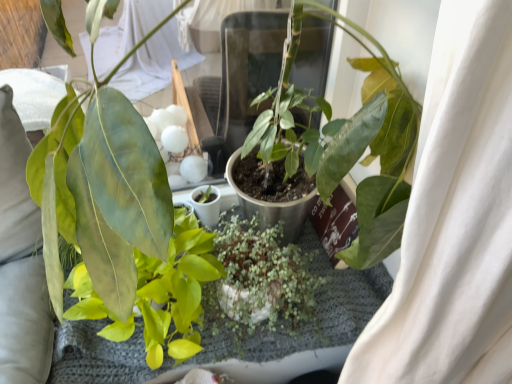
The height and width of the screenshot is (384, 512). I want to click on green matte succulent at center, the second houseplant viewed from the left, so click(265, 274).

Describe the element at coordinates (265, 274) in the screenshot. The image size is (512, 384). I see `green matte succulent at center, the 1th houseplant in the right-to-left sequence` at that location.

What is the approximate width of green glossy leaf at center, which ranks as the 2th houseplant in right-to-left order?

green glossy leaf at center, which ranks as the 2th houseplant in right-to-left order, is 10.77 inches in width.

Locate an element on the screen. green glossy leaf at center, positioned as the first houseplant in left-to-right order is located at coordinates (158, 293).

The width and height of the screenshot is (512, 384). Describe the element at coordinates (158, 293) in the screenshot. I see `green glossy leaf at center, positioned as the first houseplant in left-to-right order` at that location.

What are the coordinates of `green matte succulent at center, the second houseplant viewed from the left` in the screenshot? It's located at (265, 274).

Can you confirm if green matte succulent at center, the second houseplant viewed from the left, is positioned to the left of green glossy leaf at center, positioned as the first houseplant in left-to-right order?

No, green matte succulent at center, the second houseplant viewed from the left, is not to the left of green glossy leaf at center, positioned as the first houseplant in left-to-right order.

Which object is more forward, green matte succulent at center, the 1th houseplant in the right-to-left sequence, or green glossy leaf at center, positioned as the first houseplant in left-to-right order?

green glossy leaf at center, positioned as the first houseplant in left-to-right order.

Considering the positions of points (227, 226) and (185, 350), is point (227, 226) closer to camera compared to point (185, 350)?

No, it is not.

From the image's perspective, which one is positioned lower, green matte succulent at center, the second houseplant viewed from the left, or green glossy leaf at center, which ranks as the 2th houseplant in right-to-left order?

green matte succulent at center, the second houseplant viewed from the left, from the image's perspective.

From a real-world perspective, between green matte succulent at center, the 1th houseplant in the right-to-left sequence, and green glossy leaf at center, which ranks as the 2th houseplant in right-to-left order, who is vertically lower?

green matte succulent at center, the 1th houseplant in the right-to-left sequence, from a real-world perspective.

Can you confirm if green matte succulent at center, the second houseplant viewed from the left, is thinner than green glossy leaf at center, which ranks as the 2th houseplant in right-to-left order?

Yes, green matte succulent at center, the second houseplant viewed from the left, is thinner than green glossy leaf at center, which ranks as the 2th houseplant in right-to-left order.

Based on the photo, can you confirm if green matte succulent at center, the second houseplant viewed from the left, is shorter than green glossy leaf at center, positioned as the first houseplant in left-to-right order?

Yes.

In the scene shown: Between green matte succulent at center, the 1th houseplant in the right-to-left sequence, and green glossy leaf at center, which ranks as the 2th houseplant in right-to-left order, which one has larger size?

With larger size is green glossy leaf at center, which ranks as the 2th houseplant in right-to-left order.

Is green matte succulent at center, the 1th houseplant in the right-to-left sequence, spatially inside green glossy leaf at center, which ranks as the 2th houseplant in right-to-left order, or outside of it?

green matte succulent at center, the 1th houseplant in the right-to-left sequence, exists outside the volume of green glossy leaf at center, which ranks as the 2th houseplant in right-to-left order.

Are green matte succulent at center, the second houseplant viewed from the left, and green glossy leaf at center, which ranks as the 2th houseplant in right-to-left order, located far from each other?

No, green matte succulent at center, the second houseplant viewed from the left, is in close proximity to green glossy leaf at center, which ranks as the 2th houseplant in right-to-left order.

Is green glossy leaf at center, which ranks as the 2th houseplant in right-to-left order, at the back of green matte succulent at center, the second houseplant viewed from the left?

No.

What's the angular difference between green matte succulent at center, the second houseplant viewed from the left, and green glossy leaf at center, which ranks as the 2th houseplant in right-to-left order,'s facing directions?

5.6 degrees.

You are a GUI agent. You are given a task and a screenshot of the screen. Output one action in this format:
    pyautogui.click(x=<x>, y=<y>)
    Task: Click on the houseplant that is in front of the green matte succulent at center, the second houseplant viewed from the left
    This screenshot has height=384, width=512.
    Given the screenshot: What is the action you would take?
    pyautogui.click(x=158, y=293)

In the scene shown: Considering the relative positions of green glossy leaf at center, which ranks as the 2th houseplant in right-to-left order, and green matte succulent at center, the 1th houseplant in the right-to-left sequence, in the image provided, is green glossy leaf at center, which ranks as the 2th houseplant in right-to-left order, to the right of green matte succulent at center, the 1th houseplant in the right-to-left sequence, from the viewer's perspective?

No.

Relative to green matte succulent at center, the 1th houseplant in the right-to-left sequence, is green glossy leaf at center, which ranks as the 2th houseplant in right-to-left order, in front or behind?

Visually, green glossy leaf at center, which ranks as the 2th houseplant in right-to-left order, is located in front of green matte succulent at center, the 1th houseplant in the right-to-left sequence.

Which is closer to the camera, (x=94, y=312) or (x=292, y=326)?

The point (x=94, y=312) is more forward.

Based on the photo, from the image's perspective, between green glossy leaf at center, which ranks as the 2th houseplant in right-to-left order, and green matte succulent at center, the 1th houseplant in the right-to-left sequence, which one is located above?

green glossy leaf at center, which ranks as the 2th houseplant in right-to-left order, from the image's perspective.

Looking at this image, from a real-world perspective, does green glossy leaf at center, which ranks as the 2th houseplant in right-to-left order, sit lower than green matte succulent at center, the 1th houseplant in the right-to-left sequence?

No, from a real-world perspective, green glossy leaf at center, which ranks as the 2th houseplant in right-to-left order, is not beneath green matte succulent at center, the 1th houseplant in the right-to-left sequence.

Is green glossy leaf at center, positioned as the first houseplant in left-to-right order, wider than green matte succulent at center, the 1th houseplant in the right-to-left sequence?

Correct, the width of green glossy leaf at center, positioned as the first houseplant in left-to-right order, exceeds that of green matte succulent at center, the 1th houseplant in the right-to-left sequence.

Considering the relative sizes of green glossy leaf at center, positioned as the first houseplant in left-to-right order, and green matte succulent at center, the 1th houseplant in the right-to-left sequence, in the image provided, is green glossy leaf at center, positioned as the first houseplant in left-to-right order, shorter than green matte succulent at center, the 1th houseplant in the right-to-left sequence,?

No, green glossy leaf at center, positioned as the first houseplant in left-to-right order, is not shorter than green matte succulent at center, the 1th houseplant in the right-to-left sequence.

Considering the sizes of objects green glossy leaf at center, positioned as the first houseplant in left-to-right order, and green matte succulent at center, the 1th houseplant in the right-to-left sequence, in the image provided, who is bigger, green glossy leaf at center, positioned as the first houseplant in left-to-right order, or green matte succulent at center, the 1th houseplant in the right-to-left sequence,?

green glossy leaf at center, positioned as the first houseplant in left-to-right order, is bigger.

Is green matte succulent at center, the second houseplant viewed from the left, a part of green glossy leaf at center, positioned as the first houseplant in left-to-right order?

No.

Is green glossy leaf at center, which ranks as the 2th houseplant in right-to-left order, not close to green matte succulent at center, the 1th houseplant in the right-to-left sequence?

No, there isn't a large distance between green glossy leaf at center, which ranks as the 2th houseplant in right-to-left order, and green matte succulent at center, the 1th houseplant in the right-to-left sequence.

Is green glossy leaf at center, which ranks as the 2th houseplant in right-to-left order, aimed at green matte succulent at center, the second houseplant viewed from the left?

No, green glossy leaf at center, which ranks as the 2th houseplant in right-to-left order, is not oriented towards green matte succulent at center, the second houseplant viewed from the left.

Can you tell me how much green glossy leaf at center, positioned as the first houseplant in left-to-right order, and green matte succulent at center, the 1th houseplant in the right-to-left sequence, differ in facing direction?

There is a 5.6-degree angle between the facing directions of green glossy leaf at center, positioned as the first houseplant in left-to-right order, and green matte succulent at center, the 1th houseplant in the right-to-left sequence.

How far apart are green glossy leaf at center, positioned as the first houseplant in left-to-right order, and green matte succulent at center, the 1th houseplant in the right-to-left sequence?

green glossy leaf at center, positioned as the first houseplant in left-to-right order, is 10.36 centimeters away from green matte succulent at center, the 1th houseplant in the right-to-left sequence.

At what (x,y) coordinates should I click in order to perform the action: click on houseplant that is above the green matte succulent at center, the second houseplant viewed from the left (from the image's perspective). Please return your answer as a coordinate pair (x, y). Looking at the image, I should click on (158, 293).

The image size is (512, 384). I want to click on houseplant located above the green matte succulent at center, the 1th houseplant in the right-to-left sequence (from the image's perspective), so point(158,293).

This screenshot has height=384, width=512. In order to click on houseplant above the green matte succulent at center, the second houseplant viewed from the left (from a real-world perspective) in this screenshot , I will do `click(158, 293)`.